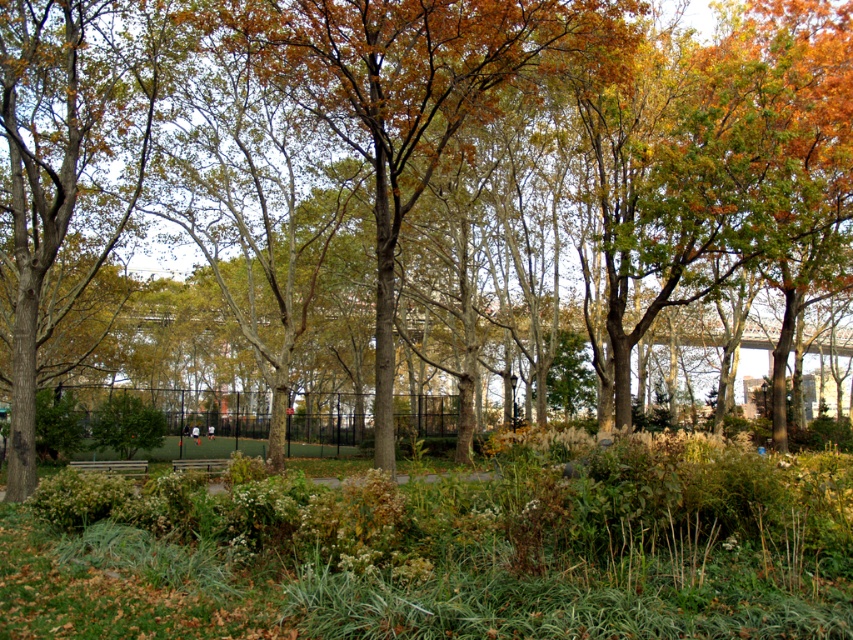
Question: Does wooden bench at lower left have a lesser width compared to wooden bench at center?

Choices:
 (A) yes
 (B) no

Answer: (A)

Question: Estimate the real-world distances between objects in this image. Which object is farther from the green grass at center?

Choices:
 (A) wooden bench at lower left
 (B) wooden bench at center
 (C) brown rough tree at lower left

Answer: (A)

Question: Which of the following is the closest to the observer?

Choices:
 (A) (140, 468)
 (B) (16, 225)
 (C) (209, 460)
 (D) (538, 436)

Answer: (B)

Question: Is green grass at center closer to camera compared to wooden bench at lower left?

Choices:
 (A) no
 (B) yes

Answer: (B)

Question: Which of the following is the closest to the observer?

Choices:
 (A) (575, 474)
 (B) (100, 467)

Answer: (A)

Question: Is brown rough tree at lower left in front of wooden bench at center?

Choices:
 (A) no
 (B) yes

Answer: (B)